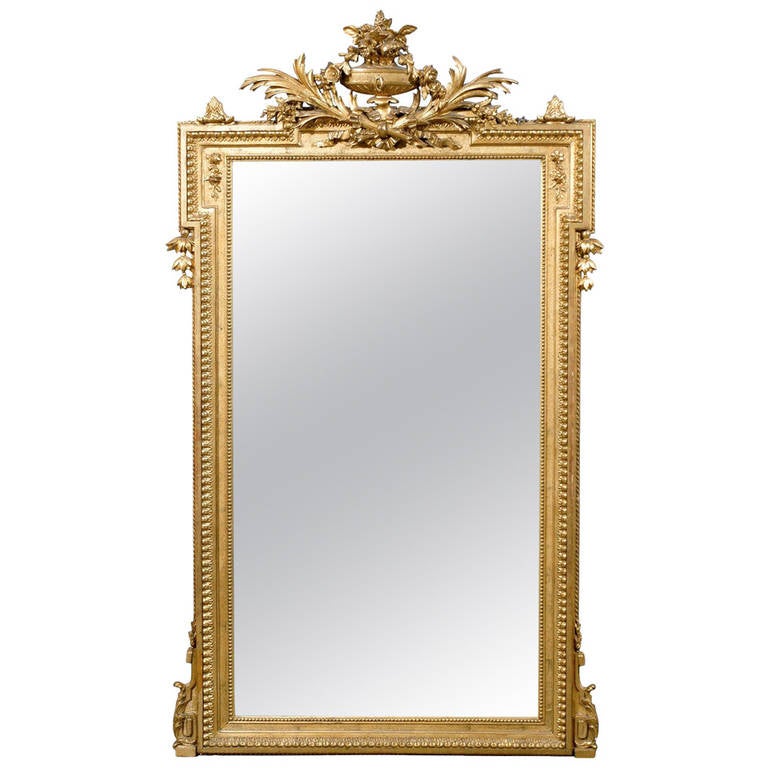
You are a GUI agent. You are given a task and a screenshot of the screen. Output one action in this format:
    pyautogui.click(x=<x>, y=<y>)
    Task: Click on the gold trim
    Image resolution: width=768 pixels, height=768 pixels.
    Given the screenshot: What is the action you would take?
    pyautogui.click(x=564, y=328), pyautogui.click(x=544, y=353), pyautogui.click(x=229, y=366), pyautogui.click(x=204, y=369)